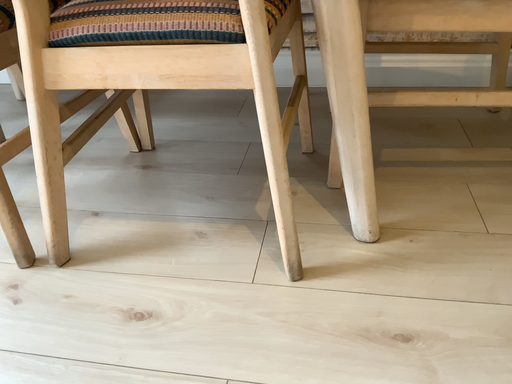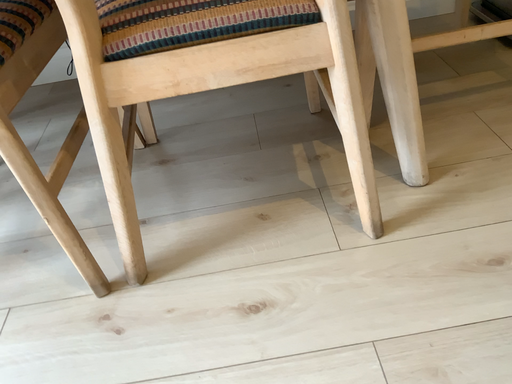
Question: Which way did the camera rotate in the video?

Choices:
 (A) rotated right
 (B) rotated left

Answer: (A)